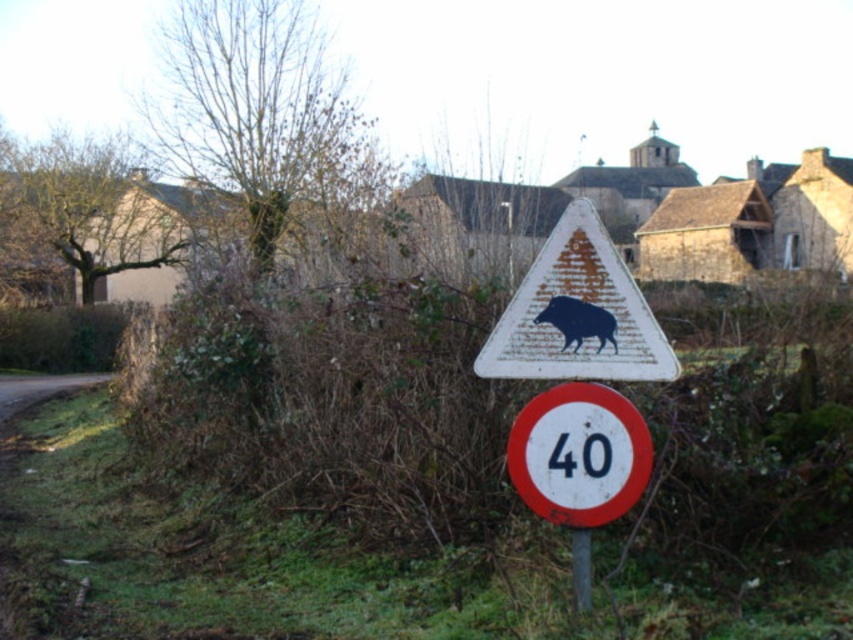
Is point (590, 337) positioned before point (582, 600)?

Yes, point (590, 337) is closer to viewer.

Between white textured triangle at center and metallic pole at center, which one appears on the right side from the viewer's perspective?

From the viewer's perspective, metallic pole at center appears more on the right side.

Image resolution: width=853 pixels, height=640 pixels. Find the location of `white textured triangle at center`. white textured triangle at center is located at coordinates (577, 314).

This screenshot has width=853, height=640. What are the coordinates of `white textured triangle at center` in the screenshot? It's located at (577, 314).

Is point (572, 321) positioned behind point (593, 440)?

That is True.

Between point (610, 326) and point (601, 436), which one is positioned behind?

Point (610, 326)

Which is behind, point (556, 314) or point (599, 465)?

Point (556, 314)

Locate an element on the screen. Image resolution: width=853 pixels, height=640 pixels. dark matte boar at center is located at coordinates point(578,321).

Is dark matte boar at center in front of metallic pole at center?

No.

Identify the location of dark matte boar at center. (578, 321).